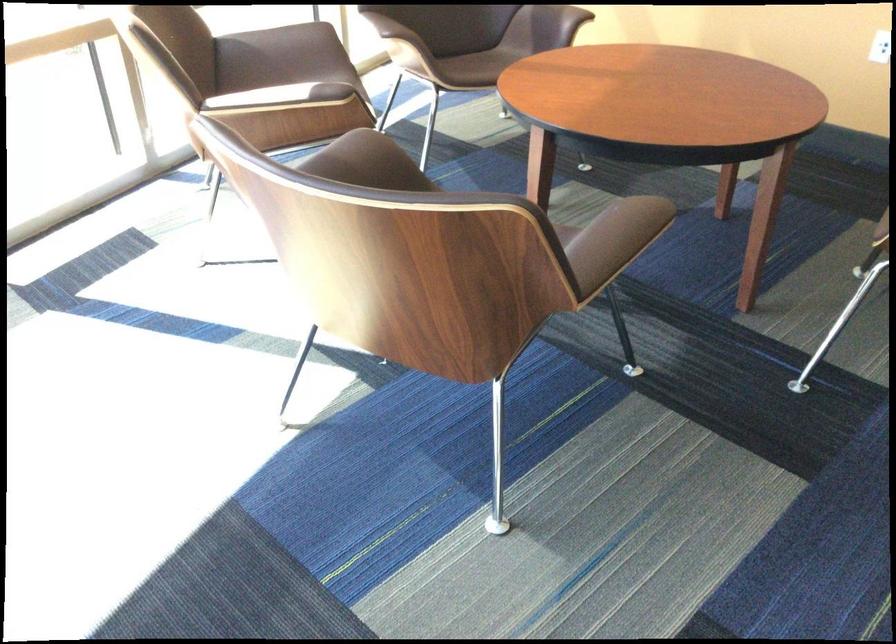
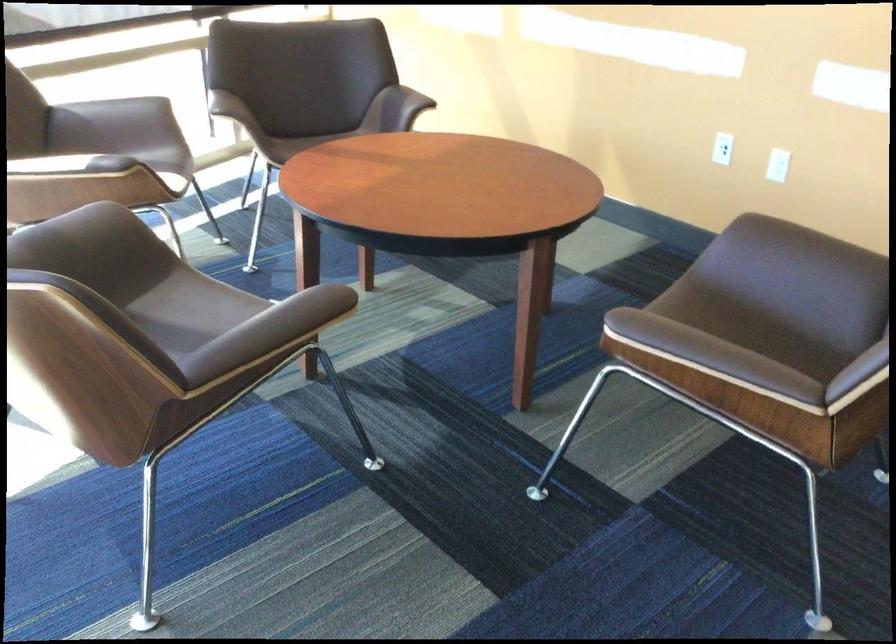
Question: What movement of the cameraman would produce the second image?

Choices:
 (A) Left
 (B) Right
 (C) Forward
 (D) Backward

Answer: (B)